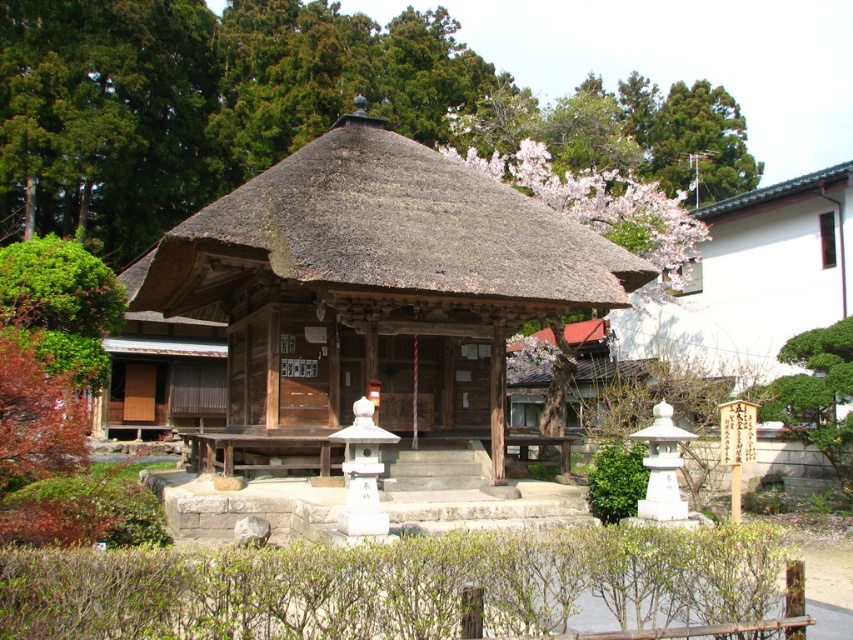
Question: Which of the following is the closest to the observer?

Choices:
 (A) thatched straw roof at center
 (B) green leafy tree at upper center

Answer: (A)

Question: Is thatched straw roof at center closer to the viewer compared to green leafy tree at upper center?

Choices:
 (A) yes
 (B) no

Answer: (A)

Question: Is thatched straw roof at center below green leafy tree at upper center?

Choices:
 (A) yes
 (B) no

Answer: (A)

Question: Is thatched straw roof at center bigger than green leafy tree at upper center?

Choices:
 (A) yes
 (B) no

Answer: (B)